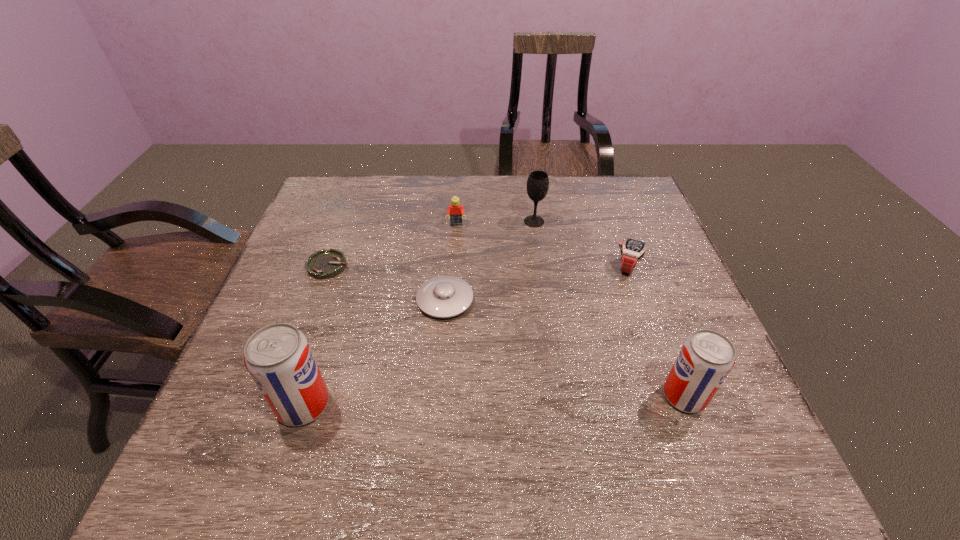
Please point a space for a new pop_(soda) to maintain equal intervals. Please provide its 2D coordinates. Your answer should be formatted as a tuple, i.e. [(x, y)], where the tuple contains the x and y coordinates of a point satisfying the conditions above.

[(495, 400)]